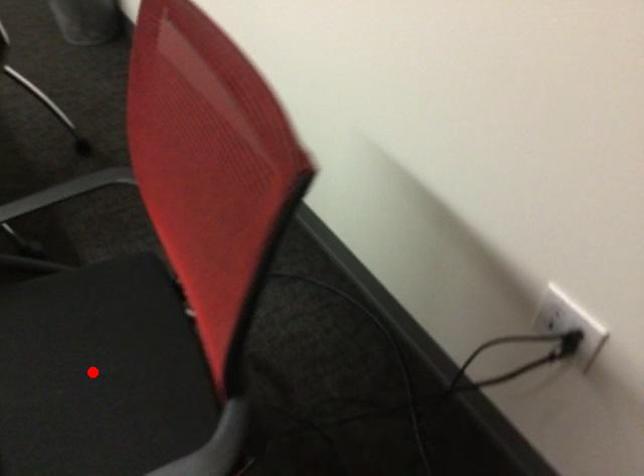
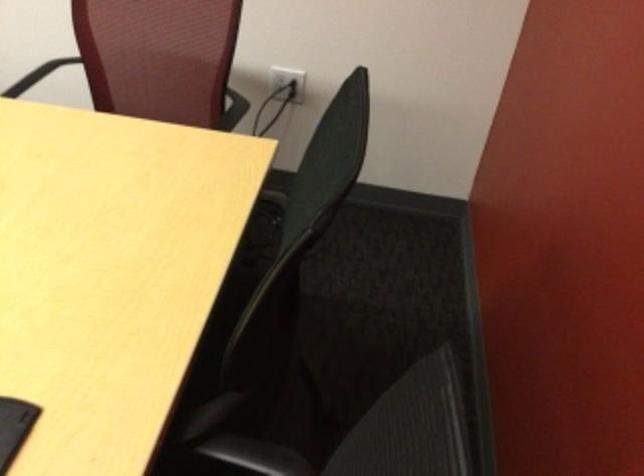
Question: I am providing you with two images of the same scene from different viewpoints. A red point is marked on the first image. Can you still see the location of the red point in image 2?

Choices:
 (A) Yes
 (B) No

Answer: (B)